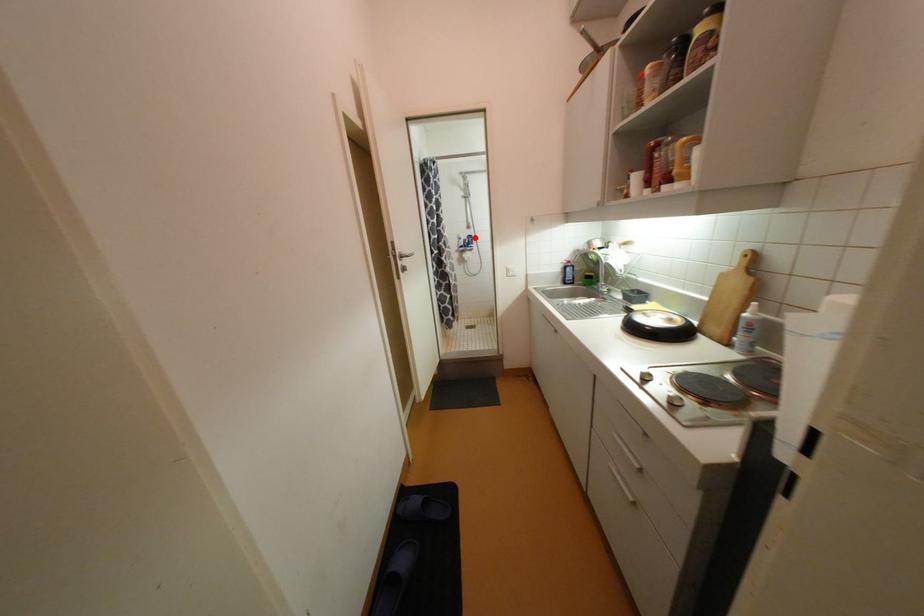
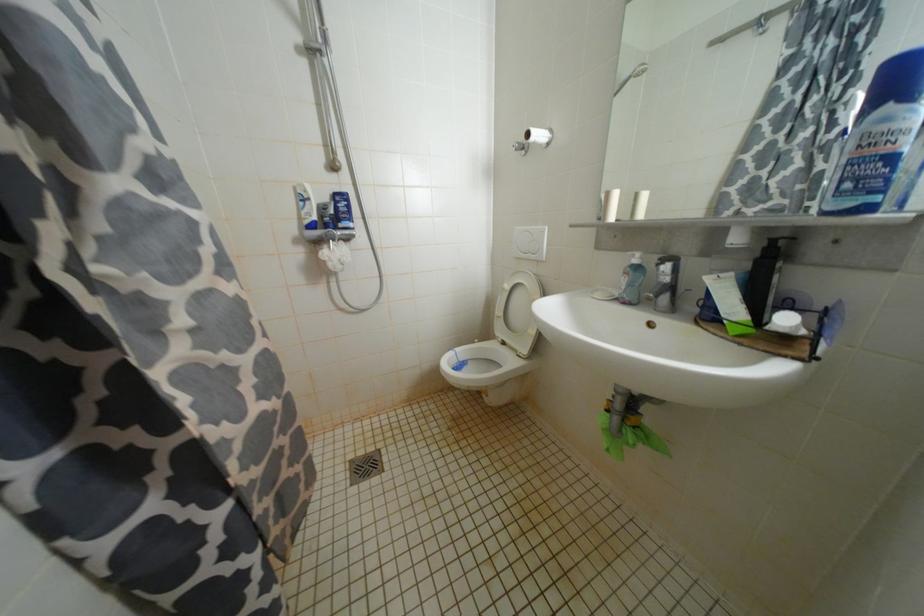
In the second image, find the point that corresponds to the highlighted location in the first image.

(345, 198)